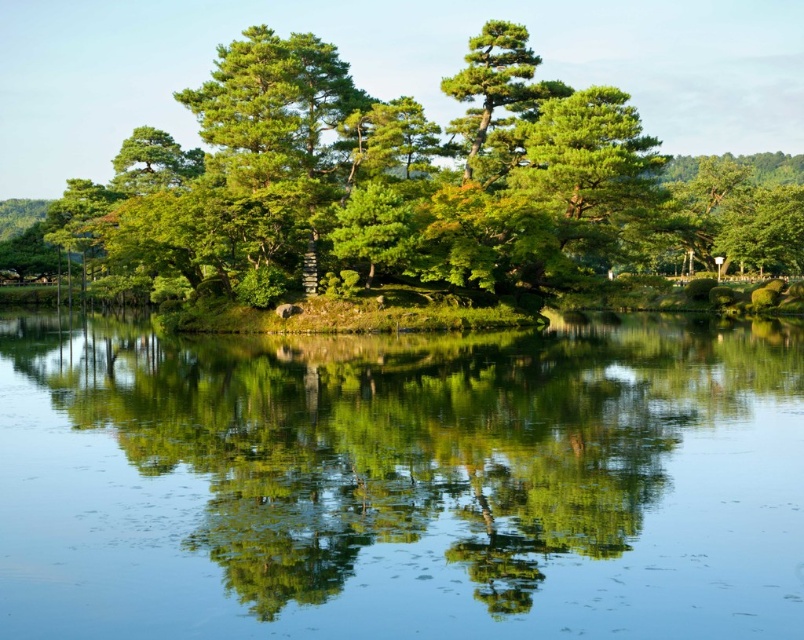
Who is more forward, (405,412) or (282,93)?

Point (405,412) is in front.

This screenshot has height=640, width=804. I want to click on clear water at center, so click(402, 483).